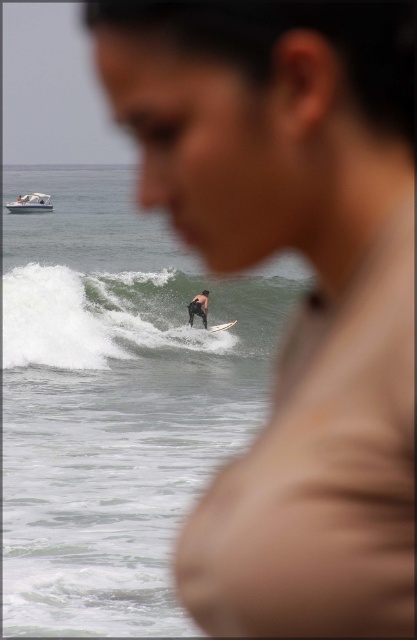
You are standing on the beach and see the white foam wave at center and the black neoprene wetsuit at center. Which object is nearer to you?

The white foam wave at center is closer to the viewer than the black neoprene wetsuit at center, so the white foam wave at center is nearer to you.

You are standing at the beach and see two points marked in the image. The first point is at coordinate point(70, 282) and the second is at point(190, 305). Based on the scene, which point is closer to the ocean?

Point(190, 305) is closer to the ocean because it is in front of point(70, 282), which is behind it.